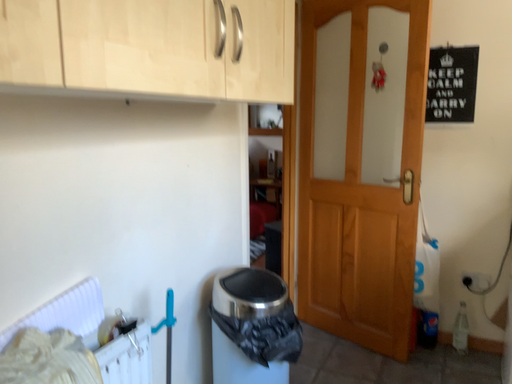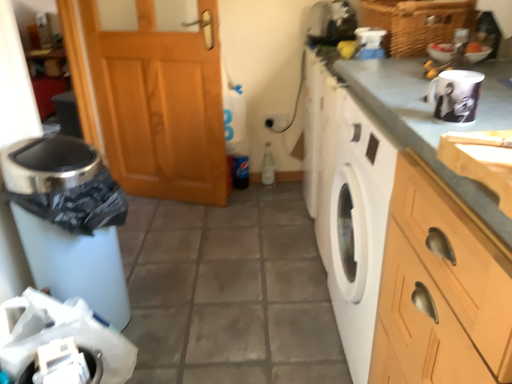
Question: How did the camera likely rotate when shooting the video?

Choices:
 (A) rotated upward
 (B) rotated downward

Answer: (B)